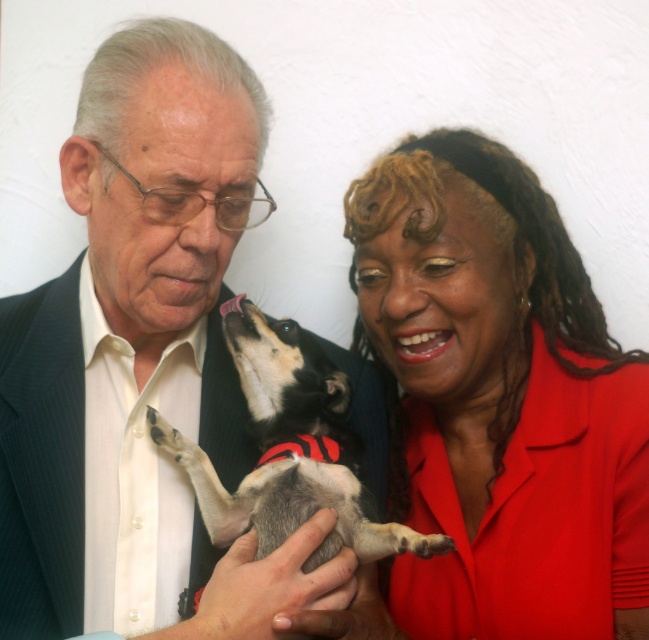
Is point (173, 544) positioned after point (395, 161)?

No, it is in front of (395, 161).

Which is more to the left, matte black suit at center or smooth red blouse at center?

matte black suit at center is more to the left.

What do you see at coordinates (141, 362) in the screenshot? I see `matte black suit at center` at bounding box center [141, 362].

Identify the location of matte black suit at center. This screenshot has height=640, width=649. (141, 362).

Is point (395, 228) farther from viewer compared to point (341, 513)?

That is True.

Is smooth red blouse at center smaller than black and white fur at center?

No, smooth red blouse at center is not smaller than black and white fur at center.

Between point (509, 340) and point (275, 400), which one is positioned behind?

Positioned behind is point (509, 340).

The width and height of the screenshot is (649, 640). What are the coordinates of `smooth red blouse at center` in the screenshot? It's located at (496, 404).

Can you confirm if matte black suit at center is positioned to the left of black and white fur at center?

Correct, you'll find matte black suit at center to the left of black and white fur at center.

Does point (10, 476) come farther from viewer compared to point (288, 440)?

No, it is not.

What are the coordinates of `matte black suit at center` in the screenshot? It's located at (141, 362).

This screenshot has height=640, width=649. Identify the location of matte black suit at center. (141, 362).